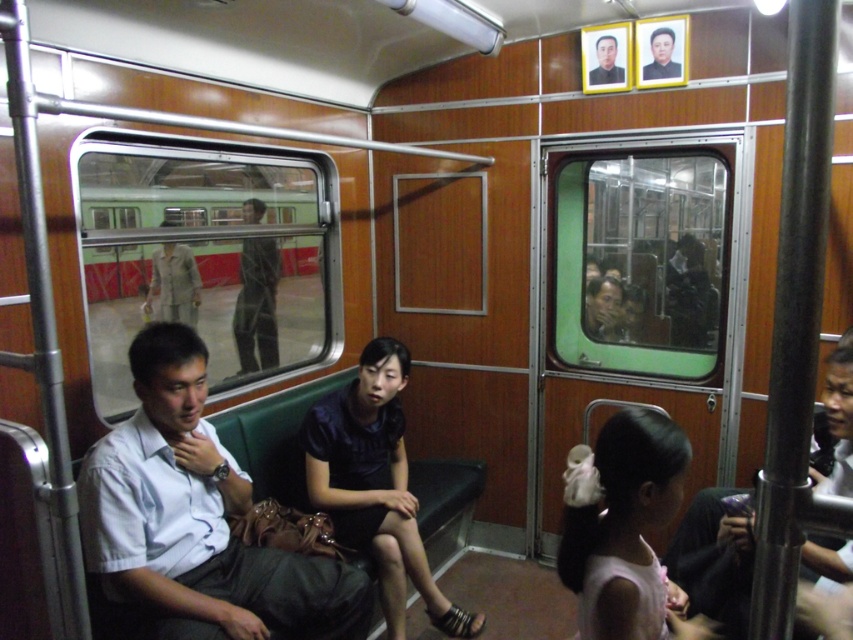
Between dark blue satin dress at center and dark blue dress at lower right, which one appears on the left side from the viewer's perspective?

dark blue satin dress at center is more to the left.

This screenshot has height=640, width=853. Find the location of `dark blue satin dress at center`. dark blue satin dress at center is located at coordinates (375, 484).

From the picture: Is green matte train at center bigger than smooth black portrait at upper center?

Yes, green matte train at center is bigger than smooth black portrait at upper center.

Where is `green matte train at center`? The width and height of the screenshot is (853, 640). green matte train at center is located at coordinates (199, 240).

Between matte white shirt at center and smooth black portrait at upper center, which one has less height?

Standing shorter between the two is smooth black portrait at upper center.

This screenshot has height=640, width=853. I want to click on matte white shirt at center, so click(x=195, y=522).